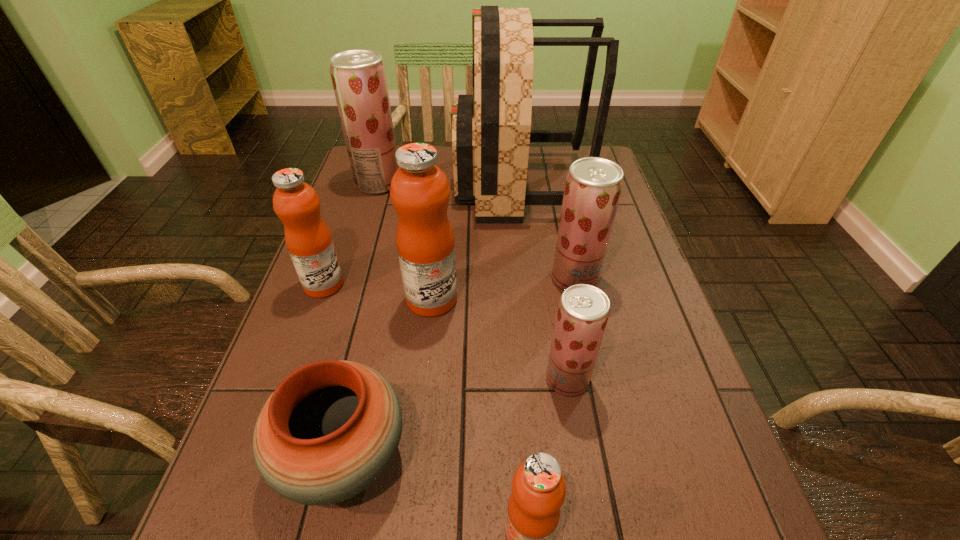
Find the location of a particular element. The image size is (960, 540). pottery is located at coordinates (331, 428).

The image size is (960, 540). I want to click on vacant space located 0.270m on the front face of the backpack, so click(368, 185).

You are a GUI agent. You are given a task and a screenshot of the screen. Output one action in this format:
    pyautogui.click(x=<x>, y=<y>)
    Task: Click on the free space located 0.290m on the front face of the backpack
    Image resolution: width=960 pixels, height=540 pixels.
    Given the screenshot: What is the action you would take?
    pyautogui.click(x=362, y=185)

Locate an element on the screen. vacant space located 0.210m on the front face of the backpack is located at coordinates (387, 185).

Find the location of a particular element. vacant area located on the front of the farthest strawberry fruit juice is located at coordinates (370, 212).

You are a GUI agent. You are given a task and a screenshot of the screen. Output one action in this format:
    pyautogui.click(x=<x>, y=<y>)
    Task: Click on the vacant region located on the front label of the third fruit juice from left to right
    This screenshot has width=960, height=540.
    Given the screenshot: What is the action you would take?
    pyautogui.click(x=509, y=299)

Identify the location of free space located on the front of the second biggest strawberry fruit juice. (608, 428).

Identify the location of free space located on the front label of the leftmost orange fruit juice. (477, 285).

Find the location of a particular element. free space located on the back of the smallest strawberry fruit juice is located at coordinates (550, 276).

This screenshot has width=960, height=540. Find the location of `free space located 0.100m on the back of the shortest object`. free space located 0.100m on the back of the shortest object is located at coordinates (367, 355).